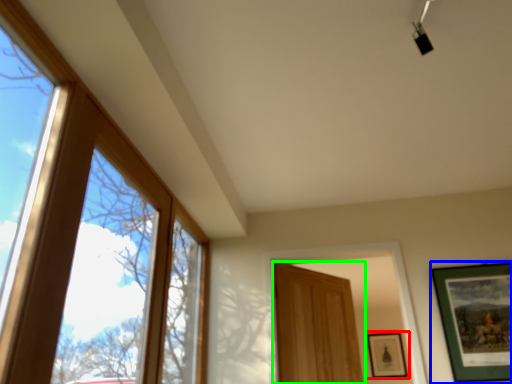
Question: Based on their relative distances, which object is farther from picture frame (highlighted by a red box)? Choose from picture frame (highlighted by a blue box) and door (highlighted by a green box).

Choices:
 (A) picture frame
 (B) door

Answer: (A)